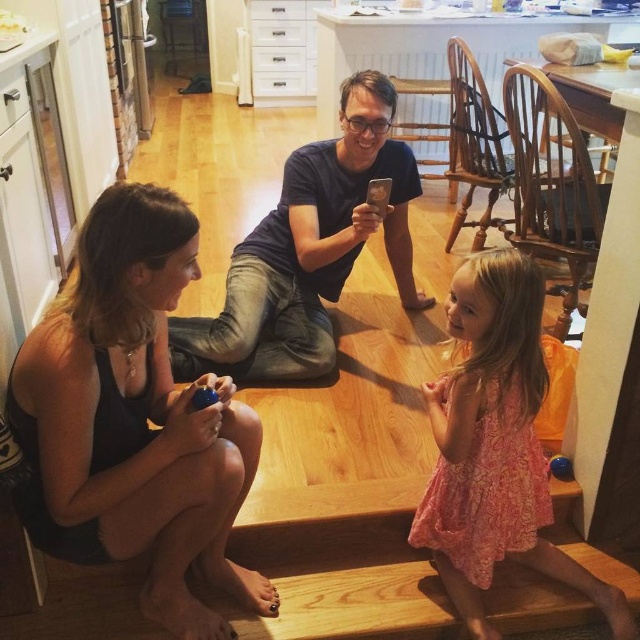
Is black matte tank top at lower left positioned before dark blue shirt at center?

Yes.

Which of these two, black matte tank top at lower left or dark blue shirt at center, stands taller?

Standing taller between the two is dark blue shirt at center.

Find the location of a particular element. The height and width of the screenshot is (640, 640). black matte tank top at lower left is located at coordinates (132, 419).

Who is lower down, pink lace dress at center or dark blue shirt at center?

pink lace dress at center

Is point (524, 464) positioned before point (397, 157)?

Yes, point (524, 464) is closer to viewer.

Locate an element on the screen. pink lace dress at center is located at coordinates (496, 445).

Is point (148, 529) positioned in front of point (452, 476)?

That is True.

Between point (218, 461) and point (509, 387), which one is positioned behind?

The point (509, 387) is more distant.

Where is `black matte tank top at lower left`? black matte tank top at lower left is located at coordinates (132, 419).